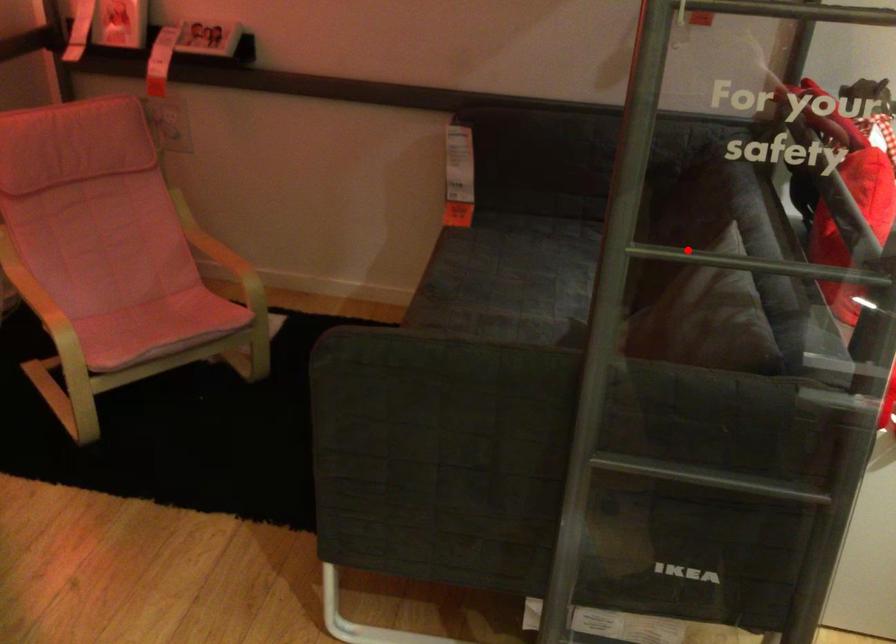
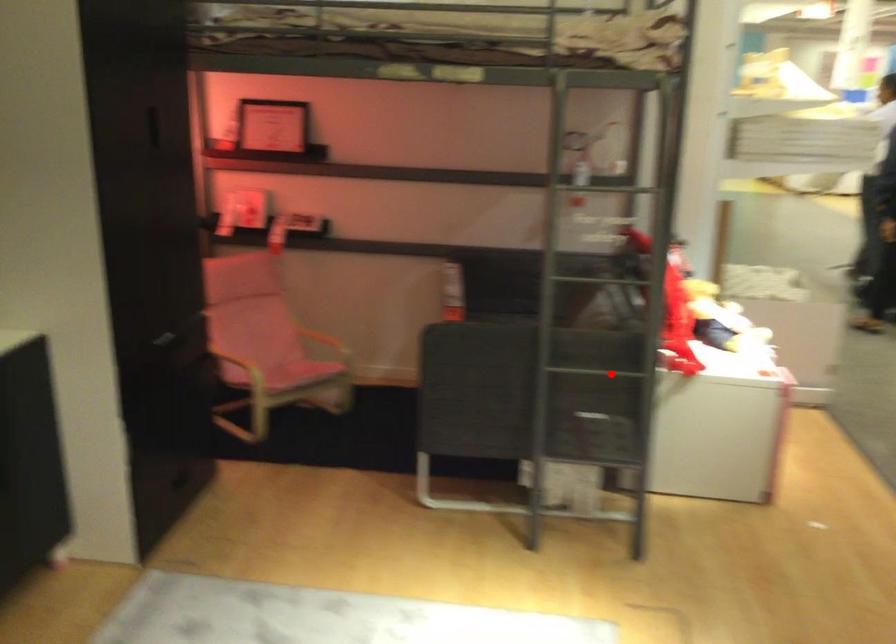
I am providing you with two images of the same scene from different viewpoints. A red point is marked on the first image and another point is marked on the second image. Is the red point in image1 aligned with the point shown in image2?

No